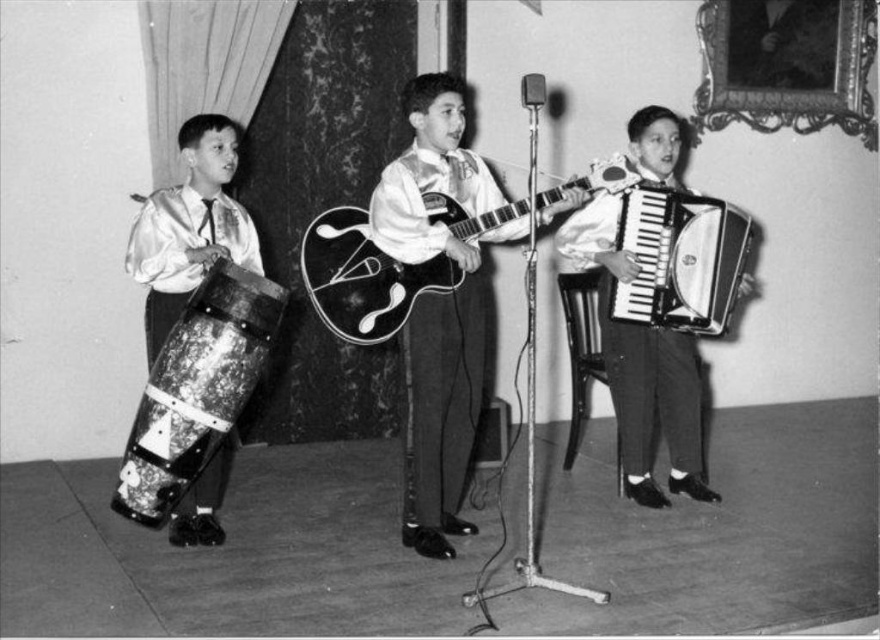
Question: Does shiny black guitar at center lie behind glossy wood guitar at center?

Choices:
 (A) yes
 (B) no

Answer: (A)

Question: Which object is closer to the camera taking this photo?

Choices:
 (A) shiny silver accordion at center
 (B) metallic silver accordion at center
 (C) distressed wood drum at left
 (D) shiny black guitar at center

Answer: (C)

Question: Which of these objects is positioned farthest from the metallic silver accordion at center?

Choices:
 (A) distressed wood drum at left
 (B) shiny silver accordion at center
 (C) glossy wood guitar at center

Answer: (A)

Question: Considering the relative positions of shiny black guitar at center and glossy wood guitar at center in the image provided, where is shiny black guitar at center located with respect to glossy wood guitar at center?

Choices:
 (A) above
 (B) below

Answer: (B)

Question: Considering the real-world distances, which object is farthest from the metallic silver accordion at center?

Choices:
 (A) distressed wood drum at left
 (B) shiny silver accordion at center
 (C) shiny black guitar at center

Answer: (A)

Question: In this image, where is glossy wood guitar at center located relative to metallic silver accordion at center?

Choices:
 (A) left
 (B) right

Answer: (A)